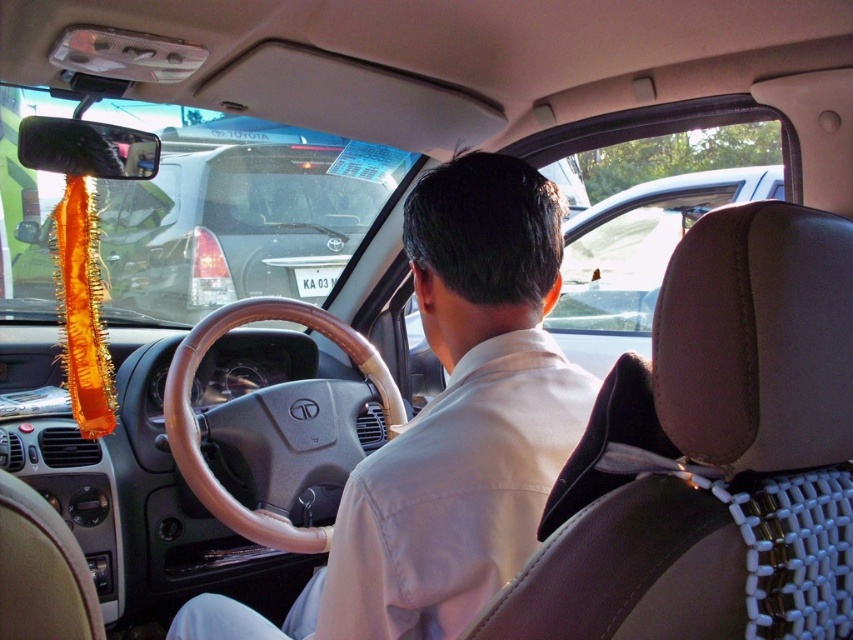
Question: Which object is closer to the camera taking this photo?

Choices:
 (A) light beige leather shirt at center
 (B) brown leather steering wheel at center

Answer: (A)

Question: Does light beige leather shirt at center come behind brown leather steering wheel at center?

Choices:
 (A) yes
 (B) no

Answer: (B)

Question: Is light beige leather shirt at center wider than brown leather steering wheel at center?

Choices:
 (A) yes
 (B) no

Answer: (B)

Question: Does light beige leather shirt at center appear on the right side of brown leather steering wheel at center?

Choices:
 (A) yes
 (B) no

Answer: (A)

Question: Among these objects, which one is nearest to the camera?

Choices:
 (A) brown leather steering wheel at center
 (B) light beige leather shirt at center

Answer: (B)